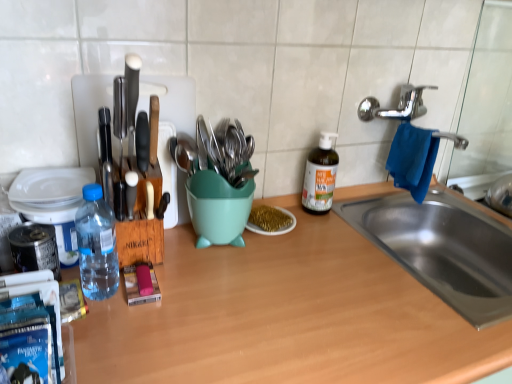
Identify the location of vacant region in front of transparent plastic bottle at left, acting as the 1th bottle starting from the front. The image size is (512, 384). (112, 342).